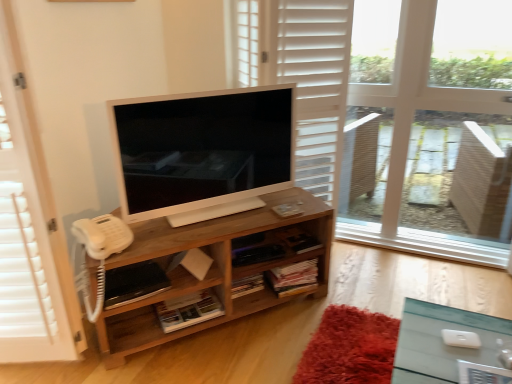
Question: From a real-world perspective, is woodenobject at center above or below white wood window frame at upper right?

Choices:
 (A) below
 (B) above

Answer: (A)

Question: Is woodenobject at center in front of or behind white wood window frame at upper right in the image?

Choices:
 (A) behind
 (B) front

Answer: (B)

Question: Estimate the real-world distances between objects in this image. Which object is closer to the woodenobject at center?

Choices:
 (A) white wooden screen door at left
 (B) white wood window frame at upper right
 (C) satin white television at center

Answer: (C)

Question: Based on their relative distances, which object is farther from the white wooden screen door at left?

Choices:
 (A) satin white television at center
 (B) woodenobject at center
 (C) white wood window frame at upper right

Answer: (C)